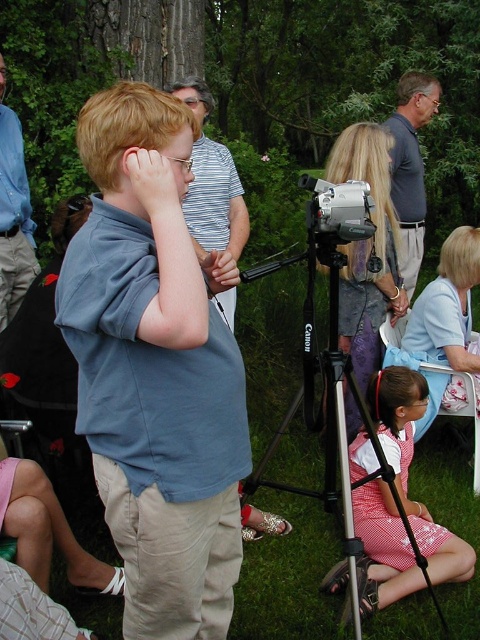
You are a photographer trying to capture a clear shot of the polka dot dress at lower right and the gray cotton shirt at upper right. Which object should you focus on to ensure it appears sharp in the photo?

The polka dot dress at lower right should be focused on because it is in front of the gray cotton shirt at upper right, so focusing on it will keep it sharp while the background might blur slightly.

You are standing at the center of the grassy area and want to take a photo of the silver metallic tripod at lower center. According to the coordinates given, in which direction should you move to get closer to the tripod?

The silver metallic tripod at lower center is located at point [453,563]. Since the coordinates are given as x and y values between 0 and 1, moving towards the direction of higher x and y values would bring you closer to the tripod. Therefore, you should move towards the upper right direction to get closer to the silver metallic tripod at lower center.